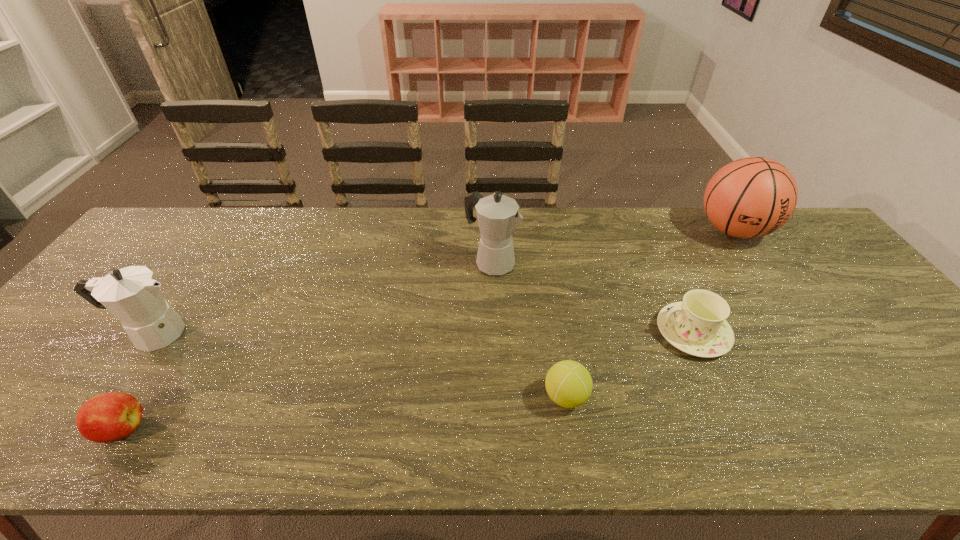
Where is `free space that satisfies the following two spatial constraints: 1. at the spout of the left coffeepot; 2. on the right side of the tennis ball`? This screenshot has width=960, height=540. free space that satisfies the following two spatial constraints: 1. at the spout of the left coffeepot; 2. on the right side of the tennis ball is located at coordinates (108, 396).

The image size is (960, 540). What are the coordinates of `free point that satisfies the following two spatial constraints: 1. on the surface of the rightmost object near the brand logo; 2. on the handle side of the second object from right to left` in the screenshot? It's located at (804, 333).

The image size is (960, 540). I want to click on free space that satisfies the following two spatial constraints: 1. at the spout of the apple; 2. on the left side of the left coffeepot, so click(84, 429).

Locate an element on the screen. This screenshot has width=960, height=540. vacant space that satisfies the following two spatial constraints: 1. on the back side of the third object from right to left; 2. at the spout of the left coffeepot is located at coordinates (556, 333).

Locate an element on the screen. This screenshot has width=960, height=540. vacant area that satisfies the following two spatial constraints: 1. at the spout of the left coffeepot; 2. on the right side of the apple is located at coordinates (84, 429).